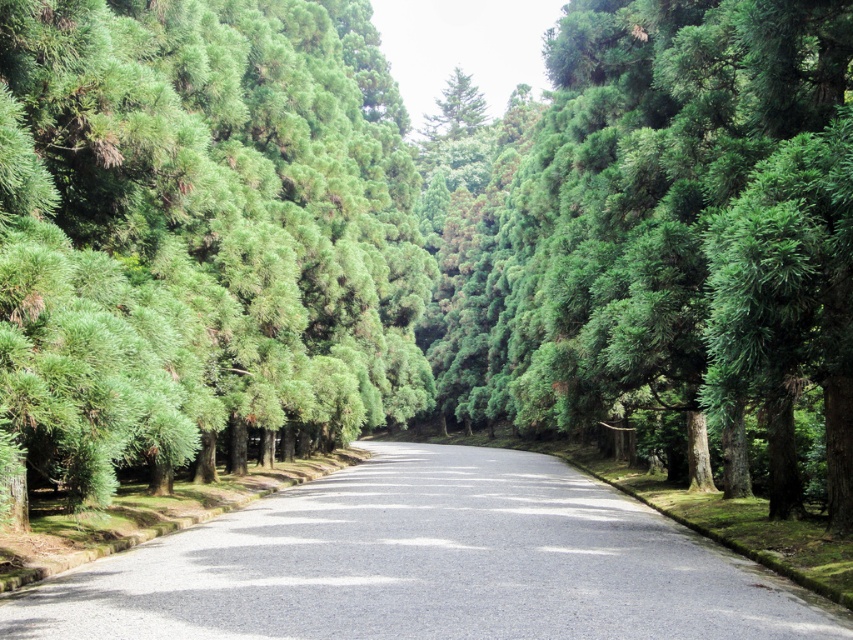
Question: Among these objects, which one is nearest to the camera?

Choices:
 (A) asphalt road at center
 (B) green leafy trees at left

Answer: (B)

Question: Does green leafy trees at left have a smaller size compared to asphalt road at center?

Choices:
 (A) yes
 (B) no

Answer: (B)

Question: Does green leafy trees at left appear over asphalt road at center?

Choices:
 (A) yes
 (B) no

Answer: (A)

Question: Which point appears closest to the camera in this image?

Choices:
 (A) (90, 81)
 (B) (807, 612)

Answer: (B)

Question: Where is green leafy trees at left located in relation to asphalt road at center in the image?

Choices:
 (A) left
 (B) right

Answer: (A)

Question: Which point is farther to the camera?

Choices:
 (A) (488, 488)
 (B) (68, 84)

Answer: (A)